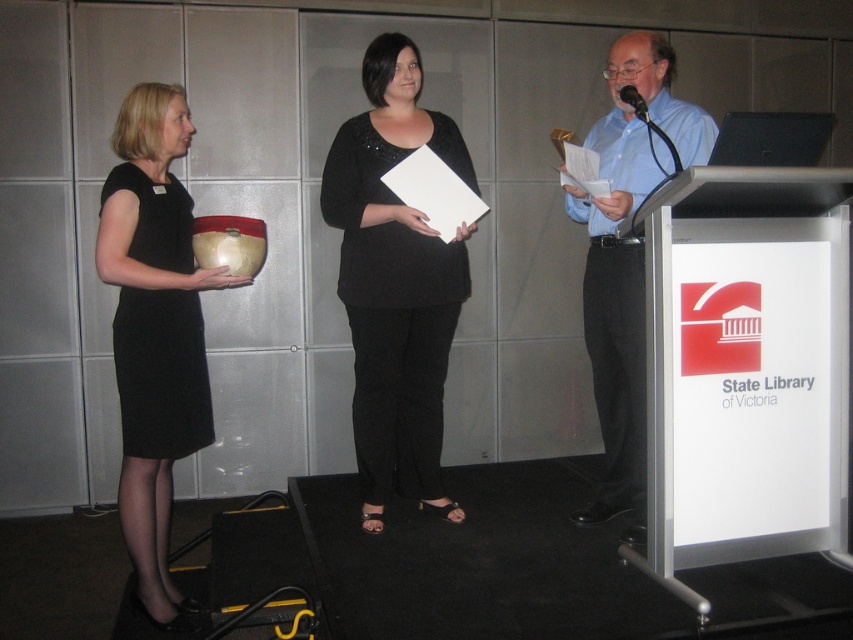
You are standing at the origin point of the stage coordinate system. Which of the two points, point (460,157) or point (119,333), is located further back from you?

Point (460,157) is behind point (119,333), so it is further back from you.

You are standing at the front of the stage at the State Library of Victoria event. You need to walk to the back of the stage. Which point should you head towards, point (128, 486) or point (154, 397)?

You should head towards point (128, 486) because it is located behind point (154, 397), meaning it is closer to the back of the stage.